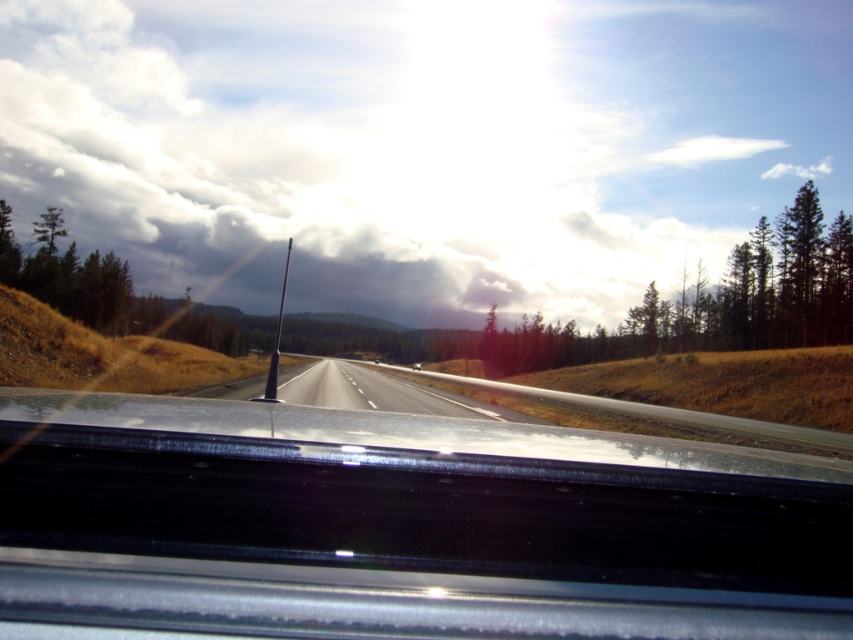
Who is higher up, white fluffy cloud at upper center or asphalt road at center?

Positioned higher is white fluffy cloud at upper center.

Between white fluffy cloud at upper center and asphalt road at center, which one has more height?

With more height is white fluffy cloud at upper center.

Locate an element on the screen. The image size is (853, 640). white fluffy cloud at upper center is located at coordinates (403, 147).